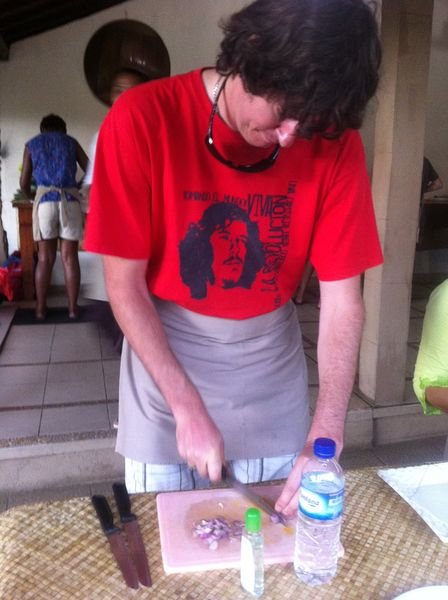
Image resolution: width=448 pixels, height=600 pixels. What are the coordinates of `hand sanitizer` in the screenshot? It's located at (247, 561).